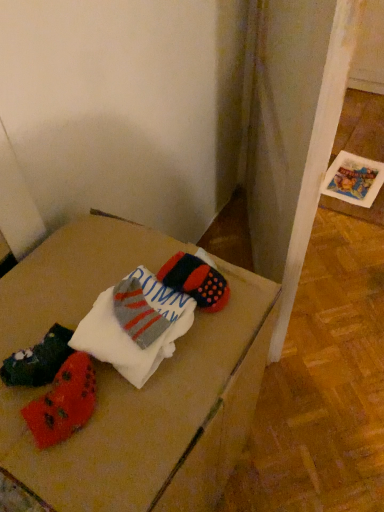
At what (x,y) coordinates should I click in order to perform the action: click on empty space that is ontop of wooden table at center (from a real-world perspective). Please return your answer as a coordinate pair (x, y). The height and width of the screenshot is (512, 384). Looking at the image, I should click on (99, 334).